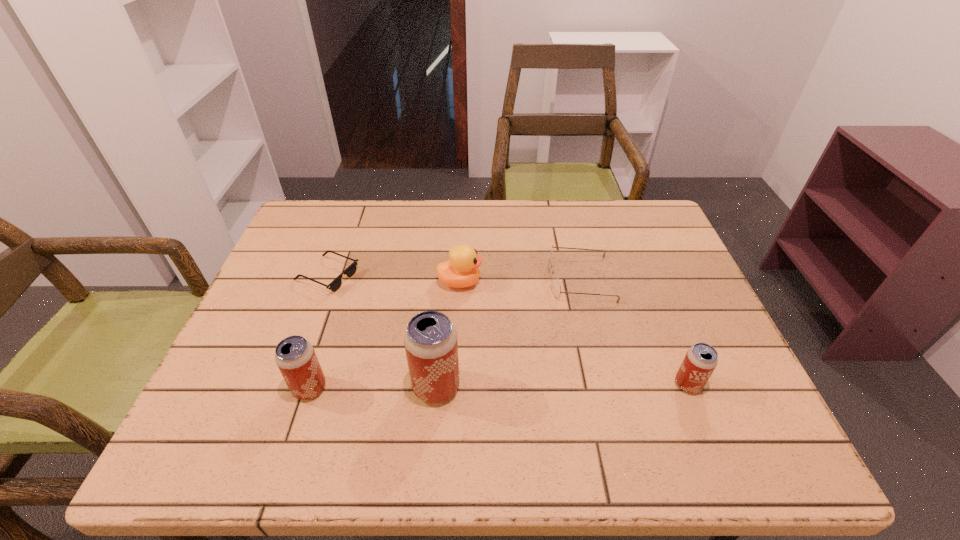
To achieve even spacing by inserting another beer_can among them, please point to a vacant spot for this new beer_can. Please provide its 2D coordinates. Your answer should be formatted as a tuple, i.e. [(x, y)], where the tuple contains the x and y coordinates of a point satisfying the conditions above.

[(563, 386)]